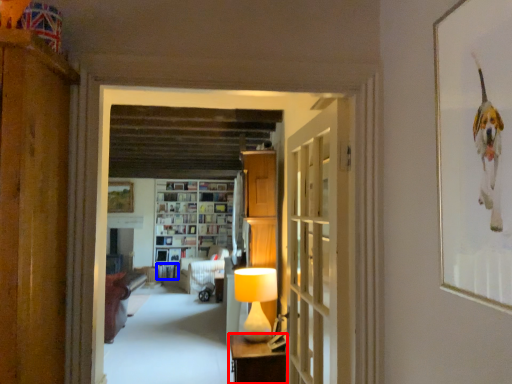
Question: Which point is further to the camera, furniture (highlighted by a red box) or book (highlighted by a blue box)?

Choices:
 (A) furniture
 (B) book

Answer: (B)